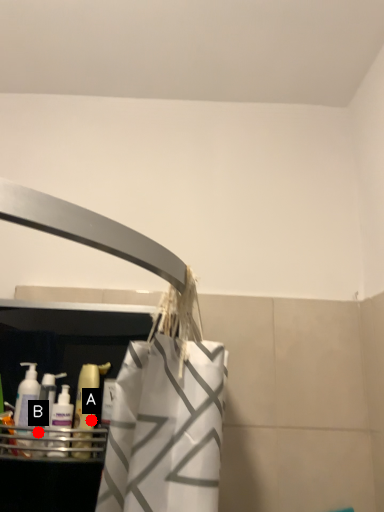
Question: Two points are circled on the image, labeled by A and B beside each circle. Which point appears closest to the camera in this image?

Choices:
 (A) A is closer
 (B) B is closer

Answer: (B)